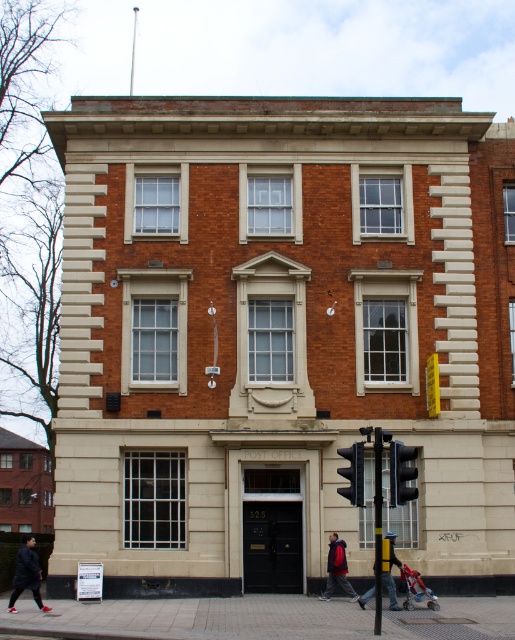
Is black plastic traffic light at lower right shorter than black matte traffic light at lower right?

Yes, black plastic traffic light at lower right is shorter than black matte traffic light at lower right.

Describe the element at coordinates (402, 474) in the screenshot. I see `black plastic traffic light at lower right` at that location.

Is point (394, 461) farther from viewer compared to point (344, 493)?

No, it is not.

Find the location of `black plastic traffic light at lower right`. black plastic traffic light at lower right is located at coordinates (402, 474).

Is point (330, 589) positioned in front of point (382, 544)?

No, (330, 589) is behind (382, 544).

Where is `red jacket at center`? Image resolution: width=515 pixels, height=640 pixels. red jacket at center is located at coordinates (336, 568).

Between point (337, 572) and point (390, 584), which one is positioned in front?

Positioned in front is point (390, 584).

Find the location of a particular element. The height and width of the screenshot is (640, 515). red jacket at center is located at coordinates (336, 568).

Is dark gray jacket at lower left bigger than black matte traffic light at lower right?

Yes.

Who is lower down, dark gray jacket at lower left or black matte traffic light at lower right?

Positioned lower is dark gray jacket at lower left.

Who is more forward, (27, 566) or (348, 454)?

Point (348, 454) is in front.

Identify the location of dark gray jacket at lower left. (26, 573).